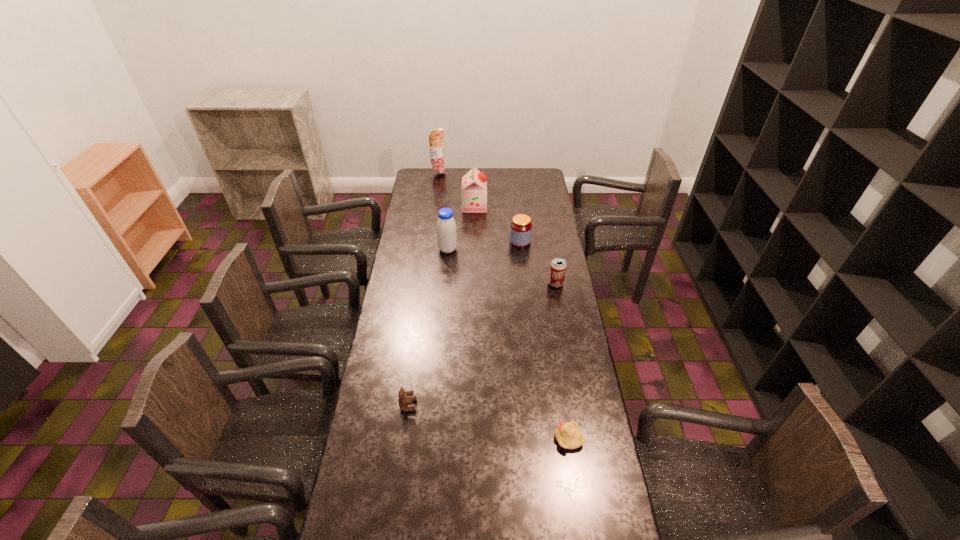
The height and width of the screenshot is (540, 960). I want to click on object that stands as the closest to the third object from left to right, so click(x=521, y=226).

Locate which object ranks in proximity to the fourth object from left to right. Please provide its 2D coordinates. Your answer should be formatted as a tuple, i.e. [(x, y)], where the tuple contains the x and y coordinates of a point satisfying the conditions above.

[(521, 226)]

Where is `free point that satisfies the following two spatial constraints: 1. with the cap open on the beer can; 2. on the right side of the sixth nearest object`? Image resolution: width=960 pixels, height=540 pixels. free point that satisfies the following two spatial constraints: 1. with the cap open on the beer can; 2. on the right side of the sixth nearest object is located at coordinates (473, 284).

The height and width of the screenshot is (540, 960). Find the location of `vacant space that satisfies the following two spatial constraints: 1. on the front side of the beer can; 2. on the face of the teddy bear`. vacant space that satisfies the following two spatial constraints: 1. on the front side of the beer can; 2. on the face of the teddy bear is located at coordinates (578, 405).

This screenshot has width=960, height=540. In order to click on blank area in the image that satisfies the following two spatial constraints: 1. on the front side of the farthest object; 2. on the left side of the fifth object from right to left in this screenshot , I will do (428, 249).

At what (x,y) coordinates should I click in order to perform the action: click on free space that satisfies the following two spatial constraints: 1. on the front side of the jar; 2. on the right side of the fifth farthest object. Please return your answer as a coordinate pair (x, y). Image resolution: width=960 pixels, height=540 pixels. Looking at the image, I should click on click(x=525, y=284).